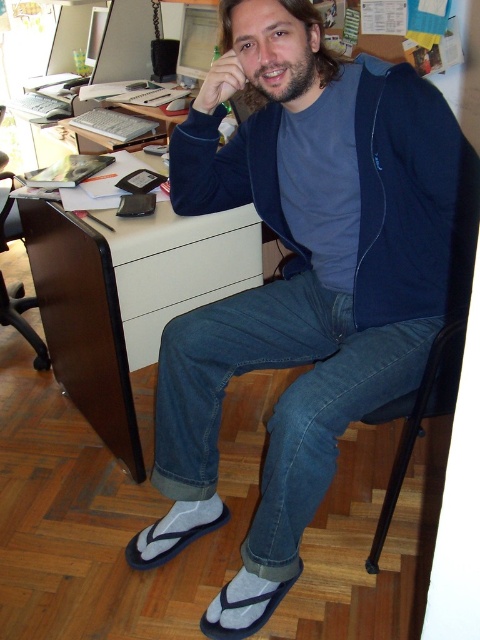
Question: Is blue cotton shirt at upper center to the right of black plastic chair at lower right from the viewer's perspective?

Choices:
 (A) no
 (B) yes

Answer: (A)

Question: Based on their relative distances, which object is nearer to the brown wood desk at center?

Choices:
 (A) blue fleece sweatshirt at center
 (B) black plastic chair at lower left

Answer: (A)

Question: Among these objects, which one is farthest from the camera?

Choices:
 (A) black plastic chair at lower right
 (B) brown wood desk at center
 (C) blue fleece sweatshirt at center
 (D) blue cotton shirt at upper center

Answer: (B)

Question: Does blue cotton shirt at upper center appear under brown wood desk at center?

Choices:
 (A) no
 (B) yes

Answer: (B)

Question: Which of the following is the farthest from the observer?

Choices:
 (A) black plastic chair at lower left
 (B) brown wood desk at center

Answer: (A)

Question: Does blue fleece sweatshirt at center appear over brown wood desk at center?

Choices:
 (A) yes
 (B) no

Answer: (A)